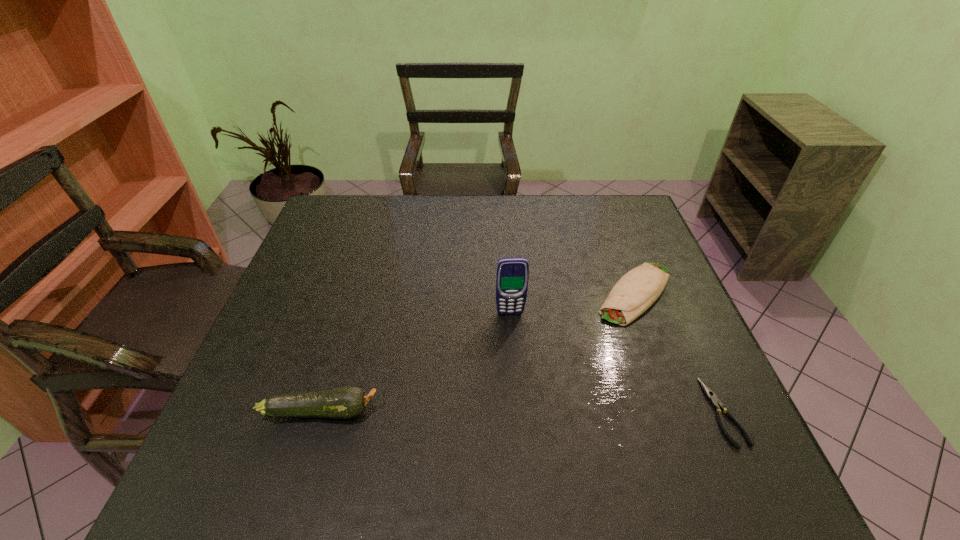
Image resolution: width=960 pixels, height=540 pixels. I want to click on object at the near right corner, so click(711, 396).

I want to click on vacant space at the far edge of the desktop, so click(x=516, y=207).

In the image, there is a desktop. Where is `vacant space at the near edge`? vacant space at the near edge is located at coordinates (341, 428).

This screenshot has width=960, height=540. What are the coordinates of `vacant space at the left edge of the desktop` in the screenshot? It's located at (349, 241).

In the image, there is a desktop. Identify the location of vacant space at the right edge. The width and height of the screenshot is (960, 540). (708, 370).

At what (x,y) coordinates should I click in order to perform the action: click on blank area at the far right corner. Please return your answer as a coordinate pair (x, y). The height and width of the screenshot is (540, 960). Looking at the image, I should click on (636, 207).

The height and width of the screenshot is (540, 960). I want to click on unoccupied area between the leftmost object and the cellular telephone, so click(x=416, y=362).

Find the location of a particular element. The width and height of the screenshot is (960, 540). free spot between the cellular telephone and the shortest object is located at coordinates (617, 363).

The image size is (960, 540). In order to click on free point between the second shortest object and the pliers in this screenshot , I will do `click(680, 352)`.

At what (x,y) coordinates should I click in order to perform the action: click on free spot between the leftmost object and the pliers. Please return your answer as a coordinate pair (x, y). This screenshot has height=540, width=960. Looking at the image, I should click on (523, 411).